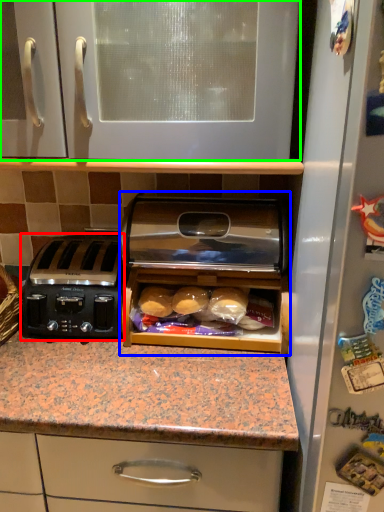
Question: Considering the real-world distances, which object is closest to toaster (highlighted by a red box)? home appliance (highlighted by a blue box) or cabinetry (highlighted by a green box).

Choices:
 (A) home appliance
 (B) cabinetry

Answer: (A)